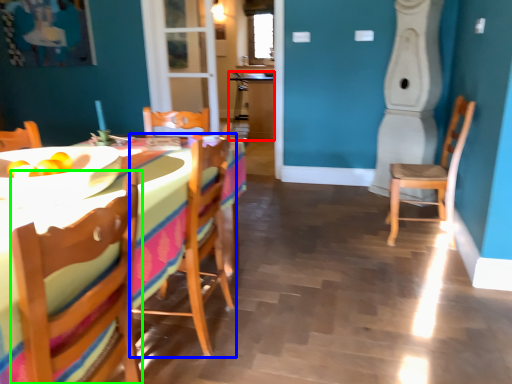
Question: Estimate the real-world distances between objects in this image. Which object is farther from table (highlighted by a red box), chair (highlighted by a blue box) or chair (highlighted by a green box)?

Choices:
 (A) chair
 (B) chair

Answer: (B)